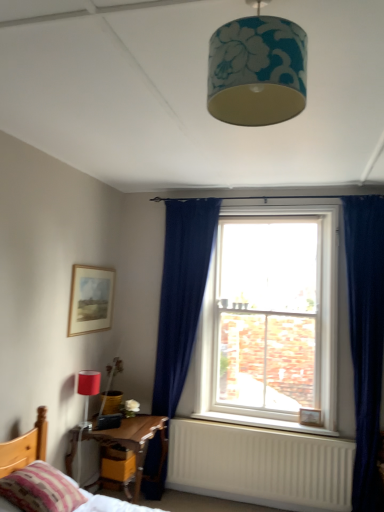
Question: From a real-world perspective, is matte red lampshade at lower left, which is the 2th lamp in front-to-back order, over teal floral fabric lampshade at upper center, the first lamp when ordered from top to bottom?

Choices:
 (A) no
 (B) yes

Answer: (A)

Question: Does matte red lampshade at lower left, which is counted as the 1th lamp, starting from the left, have a larger size compared to teal floral fabric lampshade at upper center, the first lamp when ordered from top to bottom?

Choices:
 (A) yes
 (B) no

Answer: (B)

Question: Can teal floral fabric lampshade at upper center, the 2th lamp in the left-to-right sequence, be found inside matte red lampshade at lower left, the 2th lamp in the top-to-bottom sequence?

Choices:
 (A) yes
 (B) no

Answer: (B)

Question: Does matte red lampshade at lower left, which is counted as the 2th lamp, starting from the right, have a greater width compared to teal floral fabric lampshade at upper center, the first lamp when ordered from top to bottom?

Choices:
 (A) no
 (B) yes

Answer: (A)

Question: Considering the relative positions of matte red lampshade at lower left, which is counted as the first lamp, starting from the back, and teal floral fabric lampshade at upper center, which is the 1th lamp from right to left, in the image provided, is matte red lampshade at lower left, which is counted as the first lamp, starting from the back, to the right of teal floral fabric lampshade at upper center, which is the 1th lamp from right to left, from the viewer's perspective?

Choices:
 (A) yes
 (B) no

Answer: (B)

Question: Could you tell me if matte red lampshade at lower left, which is the 2th lamp in front-to-back order, is facing teal floral fabric lampshade at upper center, the first lamp when ordered from top to bottom?

Choices:
 (A) yes
 (B) no

Answer: (B)

Question: Is wooden picture frame at lower right, which ranks as the 2th picture frame in top-to-bottom order, not near wooden bed at lower left?

Choices:
 (A) yes
 (B) no

Answer: (A)

Question: From the image's perspective, is wooden picture frame at lower right, the 1th picture frame from the right, above wooden bed at lower left?

Choices:
 (A) no
 (B) yes

Answer: (B)

Question: Is wooden picture frame at lower right, which ranks as the second picture frame in left-to-right order, facing towards wooden bed at lower left?

Choices:
 (A) yes
 (B) no

Answer: (B)

Question: Does wooden picture frame at lower right, the first picture frame from the back, lie in front of wooden bed at lower left?

Choices:
 (A) no
 (B) yes

Answer: (A)

Question: From a real-world perspective, is wooden picture frame at lower right, positioned as the second picture frame in front-to-back order, physically above wooden bed at lower left?

Choices:
 (A) yes
 (B) no

Answer: (A)

Question: Is wooden picture frame at lower right, which ranks as the 2th picture frame in top-to-bottom order, thinner than wooden bed at lower left?

Choices:
 (A) no
 (B) yes

Answer: (B)

Question: Is wooden picture frame at lower right, the 1th picture frame from the right, not inside white painted wood at lower center?

Choices:
 (A) yes
 (B) no

Answer: (A)